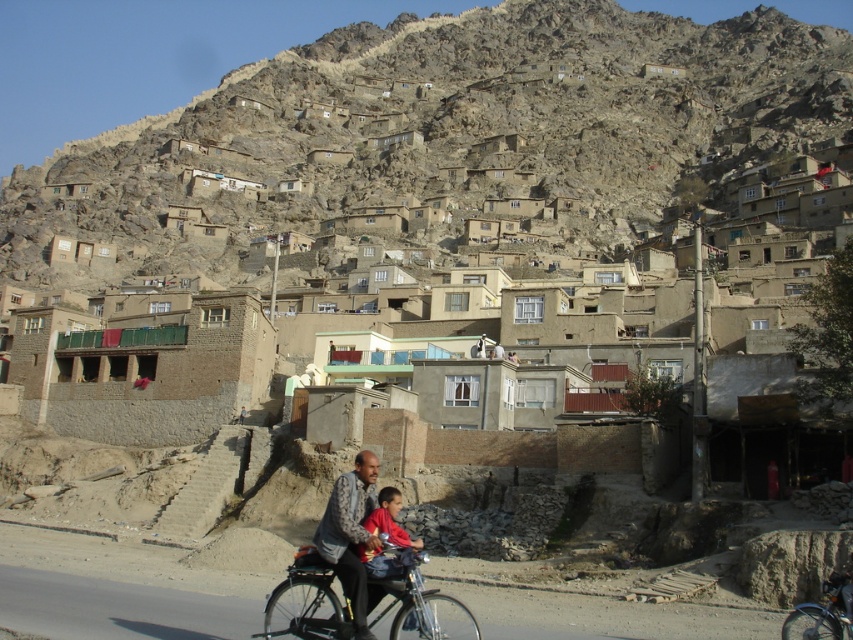
You are a traveler standing in the village square and see a metallic bicycle at center and a red cotton shirt at center. Which object is located to the left when facing the village square?

The metallic bicycle at center is positioned to the left of the red cotton shirt at center.

You are a hiker who has just arrived at the village and notice a metallic bicycle at center and a red cotton shirt at center. Which item is nearer to you?

The metallic bicycle at center is closer to the viewer than the red cotton shirt at center, so the metallic bicycle at center is nearer to you.

You are standing at the base of the mountain and looking up at the village. You see a metallic bicycle at center and a red cotton shirt at center. Which object is positioned higher up the mountain?

The red cotton shirt at center is positioned higher up the mountain than the metallic bicycle at center because the metallic bicycle at center is located below it.